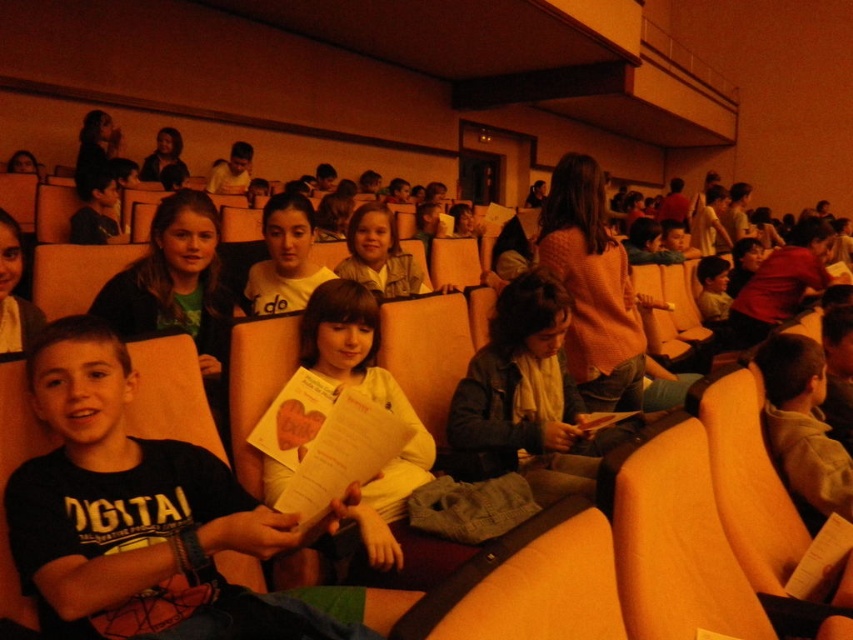
Is black cotton shirt at center above matte black jacket at upper left?

No, black cotton shirt at center is not above matte black jacket at upper left.

Between black cotton shirt at center and matte black jacket at upper left, which one has more height?

Standing taller between the two is matte black jacket at upper left.

You are a GUI agent. You are given a task and a screenshot of the screen. Output one action in this format:
    pyautogui.click(x=<x>, y=<y>)
    Task: Click on the black cotton shirt at center
    This screenshot has height=640, width=853.
    Given the screenshot: What is the action you would take?
    pyautogui.click(x=144, y=516)

Who is positioned more to the left, dark brown hair at upper left or matte black jacket at upper left?

From the viewer's perspective, dark brown hair at upper left appears more on the left side.

How distant is dark brown hair at upper left from matte black jacket at upper left?

A distance of 17.84 inches exists between dark brown hair at upper left and matte black jacket at upper left.

This screenshot has height=640, width=853. In order to click on dark brown hair at upper left in this screenshot , I will do `click(94, 148)`.

Based on the photo, can you confirm if red cotton shirt at center is positioned below matte black hair at upper left?

Indeed, red cotton shirt at center is positioned under matte black hair at upper left.

Does red cotton shirt at center appear on the left side of matte black hair at upper left?

Incorrect, red cotton shirt at center is not on the left side of matte black hair at upper left.

Describe the element at coordinates (780, 284) in the screenshot. I see `red cotton shirt at center` at that location.

Where is `red cotton shirt at center`? red cotton shirt at center is located at coordinates (780, 284).